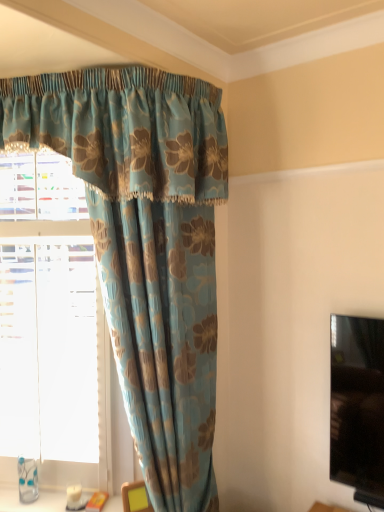
Question: Is blue floral fabric curtain at upper left closer to camera compared to blue floral curtain at upper left?

Choices:
 (A) yes
 (B) no

Answer: (A)

Question: Considering the relative sizes of blue floral fabric curtain at upper left and blue floral curtain at upper left in the image provided, is blue floral fabric curtain at upper left thinner than blue floral curtain at upper left?

Choices:
 (A) no
 (B) yes

Answer: (B)

Question: From a real-world perspective, is blue floral fabric curtain at upper left on blue floral curtain at upper left?

Choices:
 (A) yes
 (B) no

Answer: (B)

Question: From the image's perspective, does blue floral fabric curtain at upper left appear lower than blue floral curtain at upper left?

Choices:
 (A) yes
 (B) no

Answer: (A)

Question: Would you consider blue floral fabric curtain at upper left to be distant from blue floral curtain at upper left?

Choices:
 (A) yes
 (B) no

Answer: (B)

Question: From a real-world perspective, relative to blue floral curtain at upper left, is blue floral fabric curtain at upper left vertically above or below?

Choices:
 (A) above
 (B) below

Answer: (B)

Question: Is point (221, 117) closer or farther from the camera than point (6, 267)?

Choices:
 (A) closer
 (B) farther

Answer: (B)

Question: Is blue floral fabric curtain at upper left in front of or behind blue floral curtain at upper left in the image?

Choices:
 (A) behind
 (B) front

Answer: (B)

Question: Is blue floral fabric curtain at upper left wider or thinner than blue floral curtain at upper left?

Choices:
 (A) thin
 (B) wide

Answer: (A)

Question: Considering the positions of point (137, 105) and point (145, 500), is point (137, 105) closer or farther from the camera than point (145, 500)?

Choices:
 (A) closer
 (B) farther

Answer: (A)

Question: Considering the relative positions of blue floral fabric curtain at upper left and yellow fabric at lower center in the image provided, is blue floral fabric curtain at upper left to the left or to the right of yellow fabric at lower center?

Choices:
 (A) right
 (B) left

Answer: (A)

Question: From the image's perspective, is blue floral fabric curtain at upper left located above or below yellow fabric at lower center?

Choices:
 (A) above
 (B) below

Answer: (A)

Question: Choose the correct answer: Is blue floral fabric curtain at upper left inside yellow fabric at lower center or outside it?

Choices:
 (A) inside
 (B) outside

Answer: (B)

Question: In the image, is blue floral curtain at upper left on the left side or the right side of blue floral fabric curtain at upper left?

Choices:
 (A) left
 (B) right

Answer: (A)

Question: Is point (1, 342) closer or farther from the camera than point (145, 280)?

Choices:
 (A) farther
 (B) closer

Answer: (A)